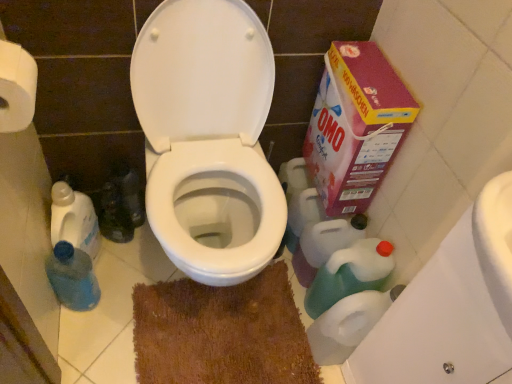
Describe the element at coordinates (348, 324) in the screenshot. I see `white plastic toilet paper at lower right, which appears as the 1th toilet paper when viewed from the back` at that location.

You are a GUI agent. You are given a task and a screenshot of the screen. Output one action in this format:
    pyautogui.click(x=<x>, y=<y>)
    Task: Click on the white glossy toilet at center
    The height and width of the screenshot is (384, 512).
    Given the screenshot: What is the action you would take?
    pyautogui.click(x=208, y=137)

What do you see at coordinates (208, 137) in the screenshot? The height and width of the screenshot is (384, 512). I see `white glossy toilet at center` at bounding box center [208, 137].

Measure the distance between green plastic bottle at lower right, the 1th cleaning product viewed from the right, and camera.

A distance of 1.17 meters exists between green plastic bottle at lower right, the 1th cleaning product viewed from the right, and camera.

The image size is (512, 384). What do you see at coordinates (221, 333) in the screenshot? I see `brown textured bath mat at center` at bounding box center [221, 333].

At what (x,y) coordinates should I click in order to perform the action: click on translucent plastic bottle at lower left, the 3th cleaning product from the right. Please return your answer as a coordinate pair (x, y). Looking at the image, I should click on (74, 219).

Locate an element on the screen. blue plastic bottle at lower left, placed as the second cleaning product when sorted from right to left is located at coordinates (73, 277).

Based on the photo, considering the relative sizes of maroon cardboard box at right and white plastic toilet paper at lower right, marked as the second toilet paper in a top-to-bottom arrangement, in the image provided, is maroon cardboard box at right smaller than white plastic toilet paper at lower right, marked as the second toilet paper in a top-to-bottom arrangement,?

Incorrect, maroon cardboard box at right is not smaller in size than white plastic toilet paper at lower right, marked as the second toilet paper in a top-to-bottom arrangement.

How distant is maroon cardboard box at right from white plastic toilet paper at lower right, the 1th toilet paper from the right?

maroon cardboard box at right and white plastic toilet paper at lower right, the 1th toilet paper from the right, are 16.28 inches apart.

Based on the photo, are maroon cardboard box at right and white plastic toilet paper at lower right, which appears as the 2th toilet paper when viewed from the left, far apart?

No, maroon cardboard box at right is in close proximity to white plastic toilet paper at lower right, which appears as the 2th toilet paper when viewed from the left.

How many degrees apart are the facing directions of maroon cardboard box at right and white plastic toilet paper at lower right, which is the 1th toilet paper in bottom-to-top order?

The angular difference between maroon cardboard box at right and white plastic toilet paper at lower right, which is the 1th toilet paper in bottom-to-top order, is 3.07 degrees.

Is blue plastic bottle at lower left, placed as the second cleaning product when sorted from right to left, in contact with translucent plastic bottle at lower left, the 1th cleaning product in the left-to-right sequence?

Yes, blue plastic bottle at lower left, placed as the second cleaning product when sorted from right to left, is with translucent plastic bottle at lower left, the 1th cleaning product in the left-to-right sequence.

Could you measure the distance between blue plastic bottle at lower left, marked as the 2th cleaning product in a left-to-right arrangement, and translucent plastic bottle at lower left, the 3th cleaning product from the right?

They are 3.59 inches apart.

Which is more to the right, blue plastic bottle at lower left, marked as the 2th cleaning product in a left-to-right arrangement, or translucent plastic bottle at lower left, the 1th cleaning product in the left-to-right sequence?

blue plastic bottle at lower left, marked as the 2th cleaning product in a left-to-right arrangement, is more to the right.

Considering the points (84, 292) and (78, 241), which point is behind, point (84, 292) or point (78, 241)?

Positioned behind is point (84, 292).

Is blue plastic bottle at lower left, marked as the 2th cleaning product in a left-to-right arrangement, far from green plastic bottle at lower right, the 1th cleaning product viewed from the right?

No, blue plastic bottle at lower left, marked as the 2th cleaning product in a left-to-right arrangement, is not far away from green plastic bottle at lower right, the 1th cleaning product viewed from the right.

From a real-world perspective, which is physically above, blue plastic bottle at lower left, marked as the 2th cleaning product in a left-to-right arrangement, or green plastic bottle at lower right, the 1th cleaning product viewed from the right?

From a 3D spatial view, green plastic bottle at lower right, the 1th cleaning product viewed from the right, is above.

Which is less distant, (75, 301) or (366, 248)?

Point (75, 301).

Which is closer to the camera, [279,269] or [364,269]?

Point [279,269] appears to be farther away from the viewer than point [364,269].

Is brown textured bath mat at center far away from green plastic bottle at lower right, which appears as the 3th cleaning product when viewed from the left?

No, brown textured bath mat at center is not far from green plastic bottle at lower right, which appears as the 3th cleaning product when viewed from the left.

From a real-world perspective, is brown textured bath mat at center positioned under green plastic bottle at lower right, which appears as the 3th cleaning product when viewed from the left, based on gravity?

Indeed, from a real-world perspective, brown textured bath mat at center is positioned beneath green plastic bottle at lower right, which appears as the 3th cleaning product when viewed from the left.

Considering the sizes of objects brown textured bath mat at center and green plastic bottle at lower right, the 1th cleaning product viewed from the right, in the image provided, who is smaller, brown textured bath mat at center or green plastic bottle at lower right, the 1th cleaning product viewed from the right,?

brown textured bath mat at center is smaller.

How different are the orientations of white glossy toilet at center and green plastic bottle at lower right, which appears as the 3th cleaning product when viewed from the left, in degrees?

The angular difference between white glossy toilet at center and green plastic bottle at lower right, which appears as the 3th cleaning product when viewed from the left, is 86.2 degrees.

Between point (147, 204) and point (380, 264), which one is positioned behind?

Positioned behind is point (380, 264).

Is white glossy toilet at center facing away from green plastic bottle at lower right, the 1th cleaning product viewed from the right?

No, white glossy toilet at center is not facing the opposite direction of green plastic bottle at lower right, the 1th cleaning product viewed from the right.

From the picture: Considering the sizes of white glossy toilet at center and green plastic bottle at lower right, the 1th cleaning product viewed from the right, in the image, is white glossy toilet at center bigger or smaller than green plastic bottle at lower right, the 1th cleaning product viewed from the right,?

Considering their sizes, white glossy toilet at center takes up more space than green plastic bottle at lower right, the 1th cleaning product viewed from the right.

Consider the image. Considering the relative sizes of white paper towel at upper left, which is the second toilet paper in back-to-front order, and blue plastic bottle at lower left, marked as the 2th cleaning product in a left-to-right arrangement, in the image provided, is white paper towel at upper left, which is the second toilet paper in back-to-front order, smaller than blue plastic bottle at lower left, marked as the 2th cleaning product in a left-to-right arrangement,?

Yes, white paper towel at upper left, which is the second toilet paper in back-to-front order, is smaller than blue plastic bottle at lower left, marked as the 2th cleaning product in a left-to-right arrangement.

Which object is more forward, white paper towel at upper left, the first toilet paper in the top-to-bottom sequence, or blue plastic bottle at lower left, placed as the second cleaning product when sorted from right to left?

white paper towel at upper left, the first toilet paper in the top-to-bottom sequence, is closer to the camera.

From the image's perspective, does white paper towel at upper left, marked as the 1th toilet paper in a left-to-right arrangement, appear higher than blue plastic bottle at lower left, marked as the 2th cleaning product in a left-to-right arrangement?

Yes, from the image's perspective, white paper towel at upper left, marked as the 1th toilet paper in a left-to-right arrangement, is on top of blue plastic bottle at lower left, marked as the 2th cleaning product in a left-to-right arrangement.

Considering the relative sizes of white paper towel at upper left, marked as the 2th toilet paper in a right-to-left arrangement, and translucent plastic bottle at lower left, the 1th cleaning product in the left-to-right sequence, in the image provided, is white paper towel at upper left, marked as the 2th toilet paper in a right-to-left arrangement, thinner than translucent plastic bottle at lower left, the 1th cleaning product in the left-to-right sequence,?

Correct, the width of white paper towel at upper left, marked as the 2th toilet paper in a right-to-left arrangement, is less than that of translucent plastic bottle at lower left, the 1th cleaning product in the left-to-right sequence.

Can you see white paper towel at upper left, marked as the 1th toilet paper in a front-to-back arrangement, touching translucent plastic bottle at lower left, the 1th cleaning product in the left-to-right sequence?

No, white paper towel at upper left, marked as the 1th toilet paper in a front-to-back arrangement, is not next to translucent plastic bottle at lower left, the 1th cleaning product in the left-to-right sequence.

From a real-world perspective, which object rests below the other?

In real-world perspective, translucent plastic bottle at lower left, the 3th cleaning product from the right, is lower.

This screenshot has width=512, height=384. In order to click on toilet paper located underneath the maroon cardboard box at right (from a real-world perspective) in this screenshot , I will do `click(348, 324)`.

From a real-world perspective, starting from the blue plastic bottle at lower left, placed as the second cleaning product when sorted from right to left, which cleaning product is the 1st one vertically above it? Please provide its 2D coordinates.

[(74, 219)]

Which object lies nearer to the anchor point translucent plastic bottle at lower left, the 1th cleaning product in the left-to-right sequence, white paper towel at upper left, which is the second toilet paper in back-to-front order, or green plastic bottle at lower right, which appears as the 3th cleaning product when viewed from the left?

white paper towel at upper left, which is the second toilet paper in back-to-front order, is closer to translucent plastic bottle at lower left, the 1th cleaning product in the left-to-right sequence.

Estimate the real-world distances between objects in this image. Which object is further from maroon cardboard box at right, brown textured bath mat at center or translucent plastic bottle at lower left, the 1th cleaning product in the left-to-right sequence?

translucent plastic bottle at lower left, the 1th cleaning product in the left-to-right sequence.

From the image, which object appears to be farther from brown textured bath mat at center, translucent plastic bottle at lower left, the 3th cleaning product from the right, or white glossy toilet at center?

translucent plastic bottle at lower left, the 3th cleaning product from the right, is positioned further to the anchor brown textured bath mat at center.

From the image, which object appears to be nearer to translucent plastic bottle at lower left, the 1th cleaning product in the left-to-right sequence, green plastic bottle at lower right, the 1th cleaning product viewed from the right, or white plastic toilet paper at lower right, which is the 1th toilet paper in bottom-to-top order?

Among the two, green plastic bottle at lower right, the 1th cleaning product viewed from the right, is located nearer to translucent plastic bottle at lower left, the 1th cleaning product in the left-to-right sequence.

Which object lies further to the anchor point white paper towel at upper left, marked as the 1th toilet paper in a left-to-right arrangement, blue plastic bottle at lower left, marked as the 2th cleaning product in a left-to-right arrangement, or maroon cardboard box at right?

The object further to white paper towel at upper left, marked as the 1th toilet paper in a left-to-right arrangement, is maroon cardboard box at right.

From the image, which object appears to be nearer to brown textured bath mat at center, green plastic bottle at lower right, the 1th cleaning product viewed from the right, or white paper towel at upper left, which is the second toilet paper in back-to-front order?

green plastic bottle at lower right, the 1th cleaning product viewed from the right, lies closer to brown textured bath mat at center than the other object.

Looking at the image, which one is located further to maroon cardboard box at right, green plastic bottle at lower right, the 1th cleaning product viewed from the right, or translucent plastic bottle at lower left, the 1th cleaning product in the left-to-right sequence?

Based on the image, translucent plastic bottle at lower left, the 1th cleaning product in the left-to-right sequence, appears to be further to maroon cardboard box at right.

Estimate the real-world distances between objects in this image. Which object is closer to green plastic bottle at lower right, which appears as the 3th cleaning product when viewed from the left, brown textured bath mat at center or maroon cardboard box at right?

Among the two, brown textured bath mat at center is located nearer to green plastic bottle at lower right, which appears as the 3th cleaning product when viewed from the left.

The image size is (512, 384). In order to click on bath mat between translucent plastic bottle at lower left, the 3th cleaning product from the right, and green plastic bottle at lower right, the 1th cleaning product viewed from the right, in the horizontal direction in this screenshot , I will do `click(221, 333)`.

This screenshot has width=512, height=384. Identify the location of toilet that lies between white paper towel at upper left, marked as the 1th toilet paper in a front-to-back arrangement, and brown textured bath mat at center from top to bottom. (208, 137).

Where is `toilet paper between blue plastic bottle at lower left, marked as the 2th cleaning product in a left-to-right arrangement, and white plastic toilet paper at lower right, which is the 1th toilet paper in bottom-to-top order, from left to right`? This screenshot has height=384, width=512. toilet paper between blue plastic bottle at lower left, marked as the 2th cleaning product in a left-to-right arrangement, and white plastic toilet paper at lower right, which is the 1th toilet paper in bottom-to-top order, from left to right is located at coordinates (16, 87).

I want to click on toilet paper positioned between white glossy toilet at center and brown textured bath mat at center from near to far, so click(x=348, y=324).